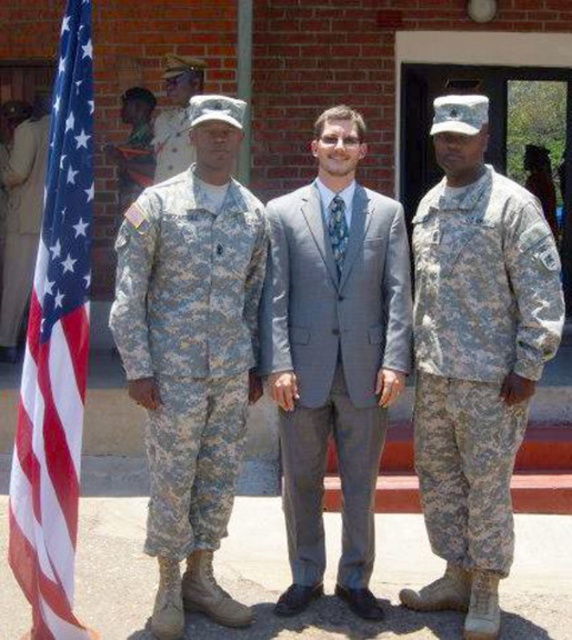
Between point (463, 486) and point (121, 310), which one is positioned behind?

The point (463, 486) is more distant.

Is camouflage fabric uniform at right to the left of camouflage fabric uniform at center from the viewer's perspective?

In fact, camouflage fabric uniform at right is to the right of camouflage fabric uniform at center.

You are a GUI agent. You are given a task and a screenshot of the screen. Output one action in this format:
    pyautogui.click(x=<x>, y=<y>)
    Task: Click on the camouflage fabric uniform at right
    This screenshot has width=572, height=640.
    Given the screenshot: What is the action you would take?
    pyautogui.click(x=478, y=355)

Is point (7, 240) positioned before point (176, 134)?

No, it is not.

Is point (37, 154) more distant than point (172, 150)?

Yes.

Does point (25, 156) come farther from viewer compared to point (164, 154)?

Yes, point (25, 156) is behind point (164, 154).

Where is `camouflage fabric uniform at left`? Image resolution: width=572 pixels, height=640 pixels. camouflage fabric uniform at left is located at coordinates (21, 221).

Does point (511, 298) come in front of point (174, 88)?

Yes, it is.

Can you confirm if camouflage fabric uniform at right is positioned to the left of camouflage uniform at center?

In fact, camouflage fabric uniform at right is to the right of camouflage uniform at center.

Is point (529, 275) farther from viewer compared to point (201, 84)?

That is False.

Identify the location of camouflage fabric uniform at right. (478, 355).